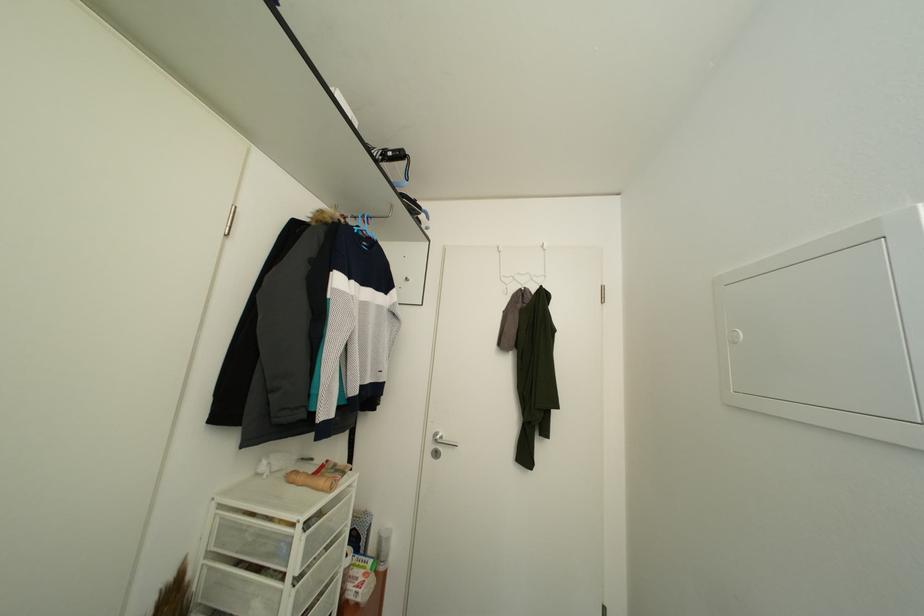
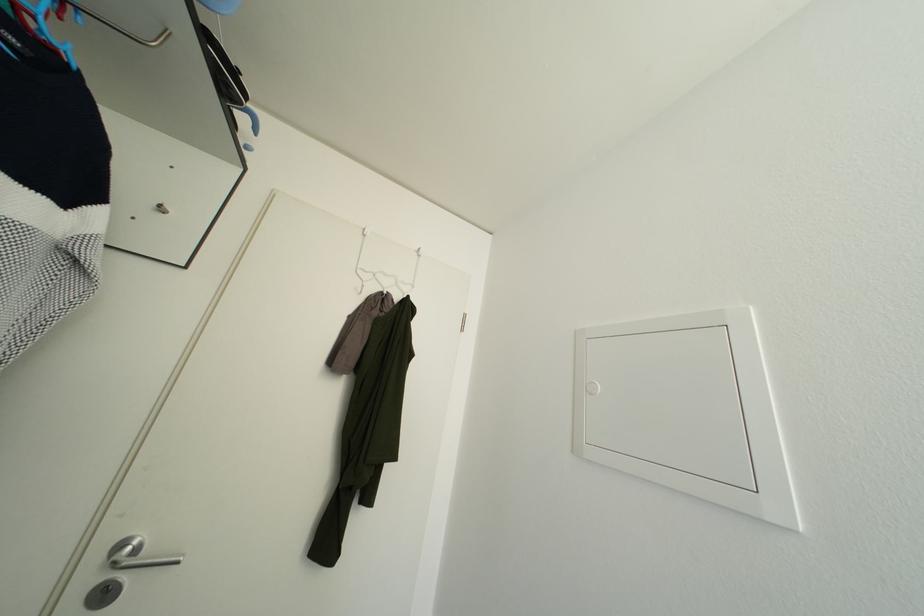
Question: The first image is from the beginning of the video and the second image is from the end. How did the camera likely rotate when shooting the video?

Choices:
 (A) Left
 (B) Right
 (C) Up
 (D) Down

Answer: (B)